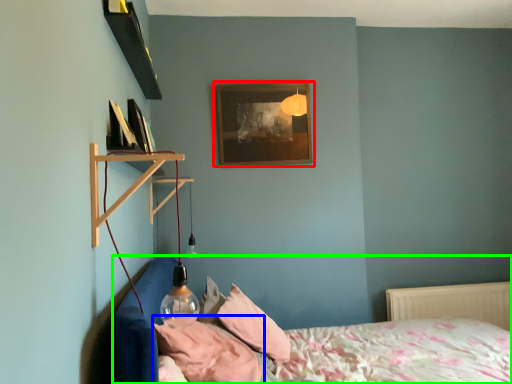
Question: Based on their relative distances, which object is nearer to picture frame (highlighted by a red box)? Choose from pillow (highlighted by a blue box) and bed (highlighted by a green box).

Choices:
 (A) pillow
 (B) bed

Answer: (B)